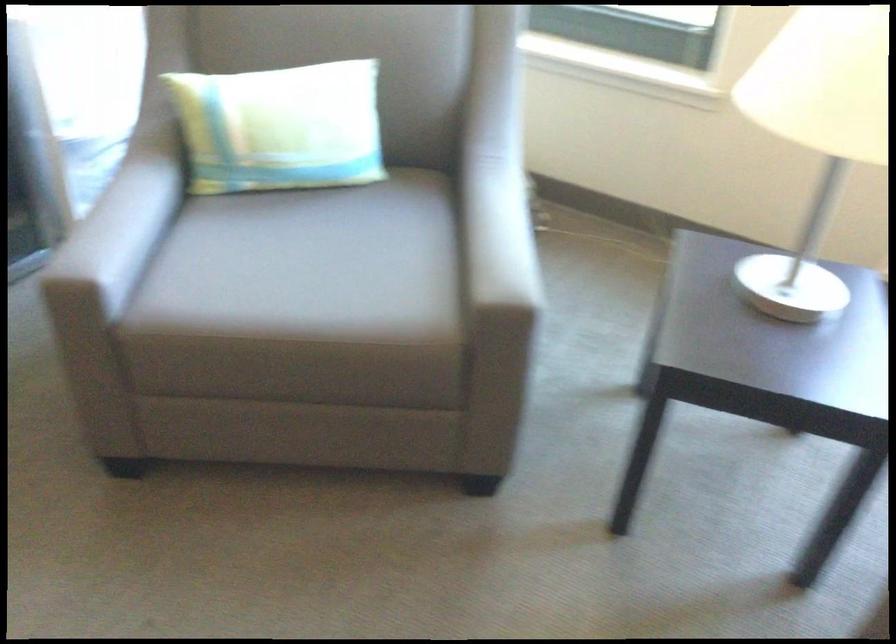
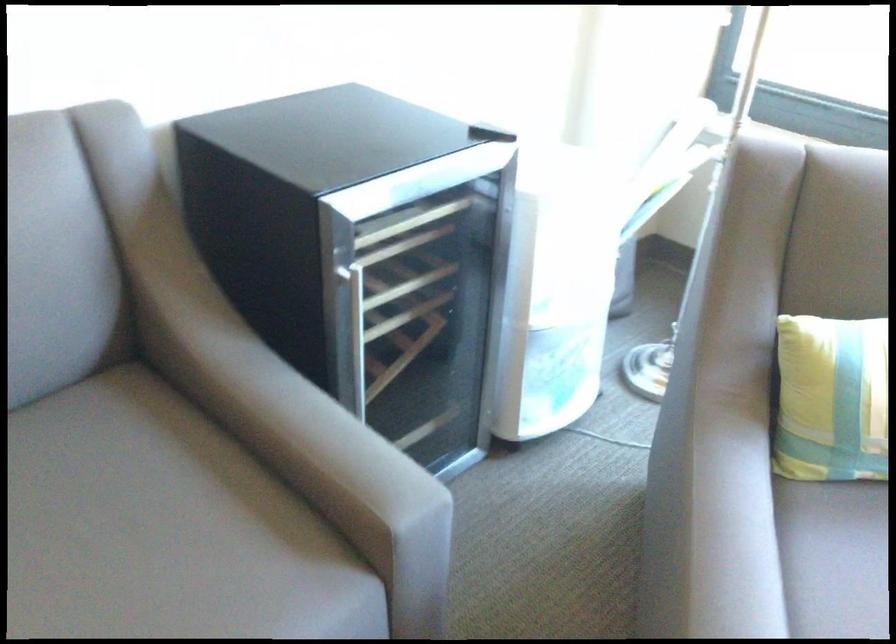
Question: The first image is from the beginning of the video and the second image is from the end. How did the camera likely rotate when shooting the video?

Choices:
 (A) Left
 (B) Right
 (C) Up
 (D) Down

Answer: (A)